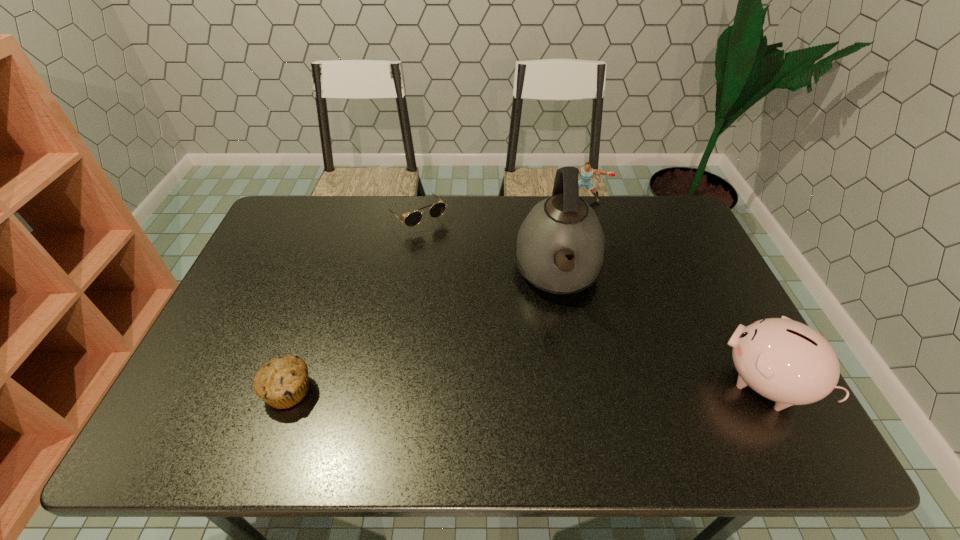
At what (x,y) coordinates should I click in order to perform the action: click on vacant position in the image that satisfies the following two spatial constraints: 1. on the front side of the tallest object; 2. on the right side of the sunglasses. Please return your answer as a coordinate pair (x, y). The image size is (960, 540). Looking at the image, I should click on (407, 274).

The width and height of the screenshot is (960, 540). I want to click on vacant space that satisfies the following two spatial constraints: 1. on the back side of the second object from left to right; 2. on the right side of the puncher, so click(x=420, y=200).